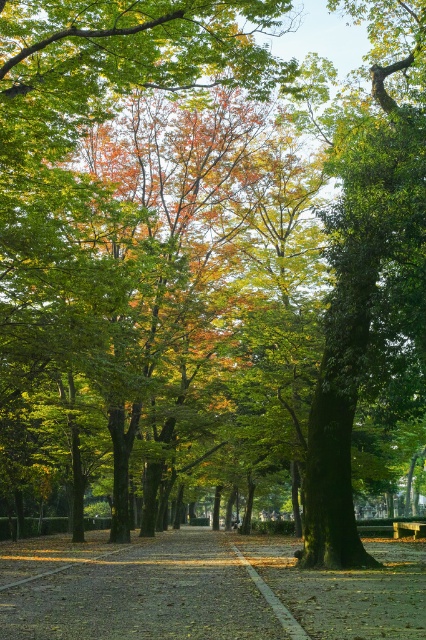
Between dirt path at center and white concrete path at center, which one is positioned higher?

white concrete path at center

Who is positioned more to the right, dirt path at center or white concrete path at center?

white concrete path at center is more to the right.

Between point (86, 595) and point (293, 625), which one is positioned behind?

The point (86, 595) is behind.

The image size is (426, 640). I want to click on dirt path at center, so click(x=141, y=588).

Who is taller, green mossy tree at center or white concrete path at center?

With more height is green mossy tree at center.

Does point (377, 237) come farther from viewer compared to point (250, 566)?

No, it is in front of (250, 566).

Where is `green mossy tree at center`? This screenshot has height=640, width=426. green mossy tree at center is located at coordinates (368, 266).

Who is more distant from viewer, (281, 624) or (397, 531)?

Point (397, 531)

Does white concrete path at center have a lesser width compared to wooden park bench at center?

Yes, white concrete path at center is thinner than wooden park bench at center.

The image size is (426, 640). Identify the location of white concrete path at center. (273, 600).

Where is `white concrete path at center`? This screenshot has height=640, width=426. white concrete path at center is located at coordinates (273, 600).